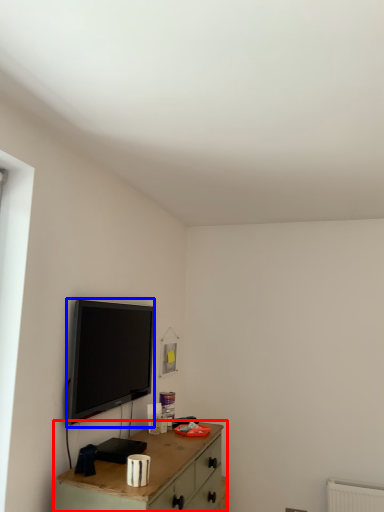
Question: Which of the following is the farthest to the observer, table (highlighted by a red box) or television (highlighted by a blue box)?

Choices:
 (A) table
 (B) television

Answer: (B)